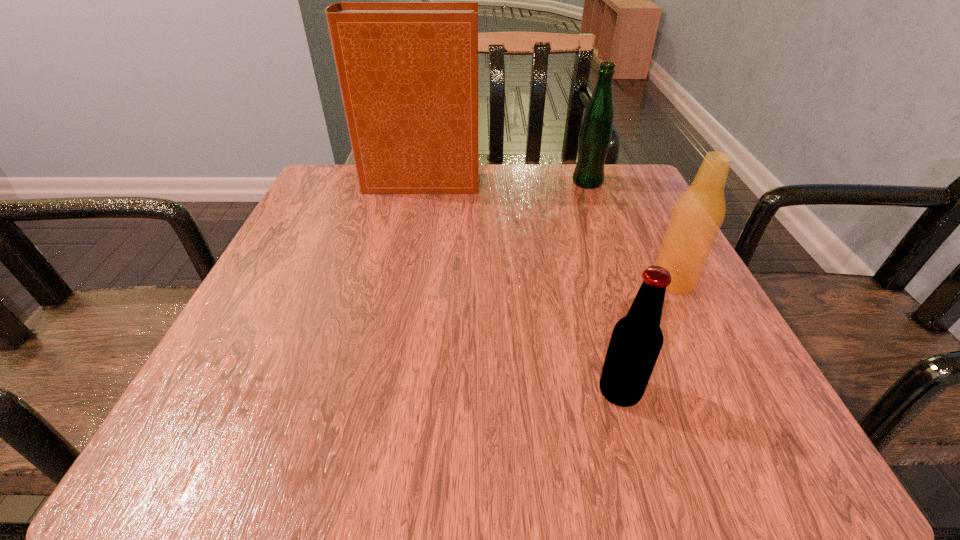
Find the location of `free space in the image that satisfies the following two spatial constraints: 1. on the open cover of the nearest object; 2. on the right side of the tallest object`. free space in the image that satisfies the following two spatial constraints: 1. on the open cover of the nearest object; 2. on the right side of the tallest object is located at coordinates (x=376, y=392).